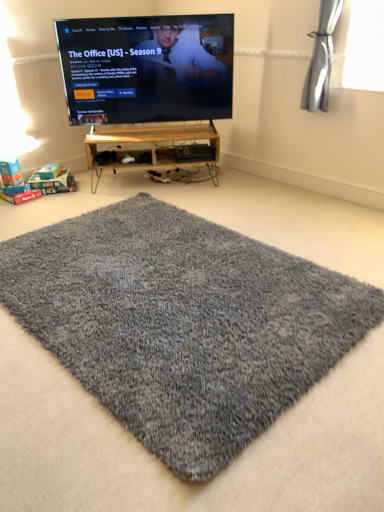
Identify the location of matte black tv at upper center. (146, 68).

Measure the distance between point (88,279) and camera.

They are 2.23 meters apart.

I want to click on wooden shelf at center, so point(157,151).

Where is `matte black tv at upper center`? matte black tv at upper center is located at coordinates (146, 68).

Which is in front, point (199, 181) or point (229, 54)?

The point (229, 54) is more forward.

In the scene shown: Is wooden shelf at center turned away from matte black tv at upper center?

No, wooden shelf at center's orientation is not away from matte black tv at upper center.

From a real-world perspective, is wooden shelf at center positioned over matte black tv at upper center based on gravity?

Actually, wooden shelf at center is physically below matte black tv at upper center in the real world.

How different are the orientations of wooden shelf at center and matte black tv at upper center in degrees?

The facing directions of wooden shelf at center and matte black tv at upper center are 1.68e-05 degrees apart.

Which object is wider, gray shaggy rug at center or wooden shelf at center?

gray shaggy rug at center is wider.

Is wooden shelf at center inside gray shaggy rug at center?

No.

From a real-world perspective, relative to wooden shelf at center, is gray shaggy rug at center vertically above or below?

From a real-world perspective, gray shaggy rug at center is physically below wooden shelf at center.

Can you tell me how much gray shaggy rug at center and wooden shelf at center differ in facing direction?

51.5 degrees.

Consider the image. Looking at the image, does matte black tv at upper center seem bigger or smaller compared to wooden shelf at center?

Considering their sizes, matte black tv at upper center takes up more space than wooden shelf at center.

Is matte black tv at upper center turned away from wooden shelf at center?

No, matte black tv at upper center is not facing the opposite direction of wooden shelf at center.

Is point (147, 80) less distant than point (186, 125)?

Yes, point (147, 80) is closer to viewer.

Between matte black tv at upper center and wooden shelf at center, which one has less height?

wooden shelf at center.

Considering the relative sizes of wooden shelf at center and gray shaggy rug at center in the image provided, is wooden shelf at center thinner than gray shaggy rug at center?

Correct, the width of wooden shelf at center is less than that of gray shaggy rug at center.

Is point (114, 163) positioned after point (128, 377)?

Yes, point (114, 163) is farther from viewer.

Is wooden shelf at center facing away from gray shaggy rug at center?

No, wooden shelf at center is not facing away from gray shaggy rug at center.

From the image's perspective, is wooden shelf at center under gray shaggy rug at center?

No, from the image's perspective, wooden shelf at center is not below gray shaggy rug at center.

How different are the orientations of matte black tv at upper center and gray shaggy rug at center in degrees?

matte black tv at upper center and gray shaggy rug at center are facing 51.5 degrees away from each other.

Is matte black tv at upper center spatially inside gray shaggy rug at center, or outside of it?

matte black tv at upper center is not enclosed by gray shaggy rug at center.

From a real-world perspective, does matte black tv at upper center stand above gray shaggy rug at center?

Yes, from a real-world perspective, matte black tv at upper center is over gray shaggy rug at center

Between matte black tv at upper center and gray shaggy rug at center, which one appears on the left side from the viewer's perspective?

matte black tv at upper center.

Which point is more forward, (x=42, y=306) or (x=102, y=26)?

The point (x=42, y=306) is in front.

Looking at their sizes, would you say gray shaggy rug at center is wider or thinner than matte black tv at upper center?

Considering their sizes, gray shaggy rug at center looks broader than matte black tv at upper center.

Who is taller, gray shaggy rug at center or matte black tv at upper center?

matte black tv at upper center.

From the image's perspective, relative to matte black tv at upper center, is gray shaggy rug at center above or below?

Clearly, from the image's perspective, gray shaggy rug at center is below matte black tv at upper center.

The image size is (384, 512). Identify the location of furniture that appears below the matte black tv at upper center (from the image's perspective). (157, 151).

I want to click on mat in front of the wooden shelf at center, so click(x=182, y=323).

Which object lies further to the anchor point gray shaggy rug at center, wooden shelf at center or matte black tv at upper center?

matte black tv at upper center is positioned further to the anchor gray shaggy rug at center.

Which object lies further to the anchor point wooden shelf at center, gray shaggy rug at center or matte black tv at upper center?

Based on the image, gray shaggy rug at center appears to be further to wooden shelf at center.

From the image, which object appears to be nearer to matte black tv at upper center, wooden shelf at center or gray shaggy rug at center?

Among the two, wooden shelf at center is located nearer to matte black tv at upper center.

From the image, which object appears to be nearer to gray shaggy rug at center, matte black tv at upper center or wooden shelf at center?

Among the two, wooden shelf at center is located nearer to gray shaggy rug at center.

Considering their positions, is matte black tv at upper center positioned closer to wooden shelf at center than gray shaggy rug at center?

matte black tv at upper center is closer to wooden shelf at center.

Looking at the image, which one is located closer to matte black tv at upper center, gray shaggy rug at center or wooden shelf at center?

wooden shelf at center is positioned closer to the anchor matte black tv at upper center.

This screenshot has height=512, width=384. Find the location of `television between gray shaggy rug at center and wooden shelf at center in the front-back direction`. television between gray shaggy rug at center and wooden shelf at center in the front-back direction is located at coordinates [146, 68].